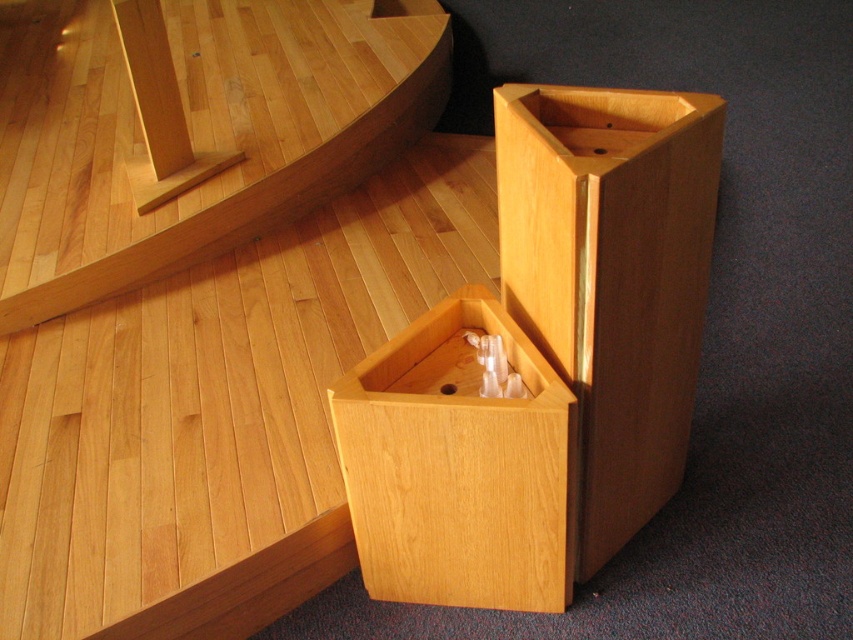
Between natural wood table at upper left and natural wood drawer at center, which one appears on the right side from the viewer's perspective?

natural wood drawer at center

Is natural wood table at upper left thinner than natural wood drawer at center?

No.

Which is behind, point (74, 186) or point (544, 484)?

The point (74, 186) is more distant.

At what (x,y) coordinates should I click in order to perform the action: click on natural wood table at upper left. Please return your answer as a coordinate pair (x, y). Looking at the image, I should click on (192, 131).

From the picture: Is light wood/wooden box at center taller than natural wood table at upper left?

No.

Who is more distant from viewer, [547,346] or [164,252]?

Positioned behind is point [164,252].

Which is behind, point (479, 454) or point (271, 134)?

Point (271, 134)

You are a GUI agent. You are given a task and a screenshot of the screen. Output one action in this format:
    pyautogui.click(x=<x>, y=<y>)
    Task: Click on the light wood/wooden box at center
    This screenshot has height=640, width=853.
    Given the screenshot: What is the action you would take?
    coord(544,362)

Can you confirm if light wood/wooden box at center is shorter than natural wood drawer at center?

No.

In the scene shown: Who is positioned more to the left, light wood/wooden box at center or natural wood drawer at center?

Positioned to the left is natural wood drawer at center.

Is point (409, 464) closer to viewer compared to point (553, 545)?

Yes, it is in front of point (553, 545).

I want to click on light wood/wooden box at center, so click(544, 362).